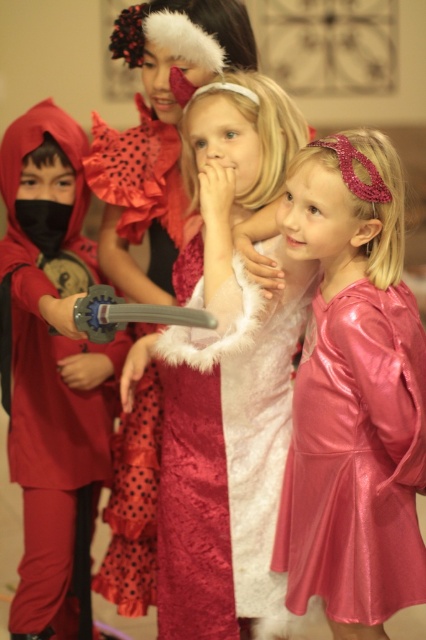
Does shiny pink dress at lower right appear under velvet maroon dress at center?

Indeed, shiny pink dress at lower right is positioned under velvet maroon dress at center.

From the picture: Does shiny pink dress at lower right come in front of velvet maroon dress at center?

Yes, it is.

Who is more forward, (281, 502) or (256, 388)?

Point (281, 502) is more forward.

I want to click on shiny pink dress at lower right, so click(356, 458).

Between point (17, 417) and point (244, 476), which one is positioned behind?

Point (17, 417)

Where is `matte red costume at left`? matte red costume at left is located at coordinates (51, 371).

This screenshot has height=640, width=426. I want to click on matte red costume at left, so click(51, 371).

Can you confirm if matte red costume at left is positioned below shiny pink dress at lower right?

Incorrect, matte red costume at left is not positioned below shiny pink dress at lower right.

Who is more forward, (54, 579) or (382, 385)?

Point (382, 385)

Identify the location of matte red costume at left. (51, 371).